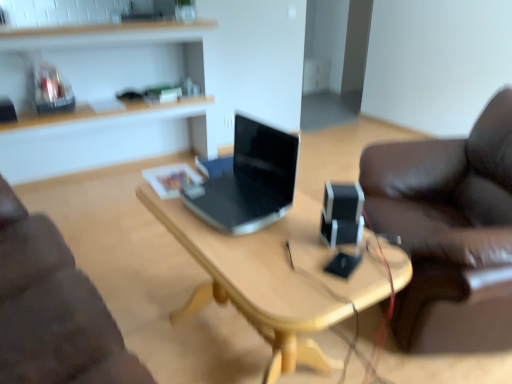
Question: From the image's perspective, would you say black plastic speaker at center is shown under wooden at upper left?

Choices:
 (A) yes
 (B) no

Answer: (A)

Question: Does black plastic speaker at center contain wooden at upper left?

Choices:
 (A) no
 (B) yes

Answer: (A)

Question: From a real-world perspective, does black plastic speaker at center stand above wooden at upper left?

Choices:
 (A) no
 (B) yes

Answer: (B)

Question: Is black plastic speaker at center wider than wooden at upper left?

Choices:
 (A) no
 (B) yes

Answer: (A)

Question: Is black plastic speaker at center at the right side of wooden at upper left?

Choices:
 (A) no
 (B) yes

Answer: (B)

Question: Considering the positions of wooden desk at center and sleek black laptop at center in the image, is wooden desk at center bigger or smaller than sleek black laptop at center?

Choices:
 (A) small
 (B) big

Answer: (B)

Question: From a real-world perspective, is wooden desk at center above or below sleek black laptop at center?

Choices:
 (A) below
 (B) above

Answer: (A)

Question: Looking at their shapes, would you say wooden desk at center is wider or thinner than sleek black laptop at center?

Choices:
 (A) wide
 (B) thin

Answer: (A)

Question: From the image's perspective, is wooden desk at center located above or below sleek black laptop at center?

Choices:
 (A) below
 (B) above

Answer: (A)

Question: From a real-world perspective, is sleek black laptop at center positioned above or below wooden desk at center?

Choices:
 (A) below
 (B) above

Answer: (B)

Question: From the image's perspective, is sleek black laptop at center above or below wooden desk at center?

Choices:
 (A) above
 (B) below

Answer: (A)

Question: In the image, is sleek black laptop at center positioned in front of or behind wooden desk at center?

Choices:
 (A) behind
 (B) front

Answer: (A)

Question: Based on their positions, is sleek black laptop at center located to the left or right of wooden desk at center?

Choices:
 (A) left
 (B) right

Answer: (A)

Question: Considering the positions of wooden desk at center and black plastic speaker at center in the image, is wooden desk at center taller or shorter than black plastic speaker at center?

Choices:
 (A) tall
 (B) short

Answer: (A)

Question: Visually, is wooden desk at center positioned to the left or to the right of black plastic speaker at center?

Choices:
 (A) left
 (B) right

Answer: (A)